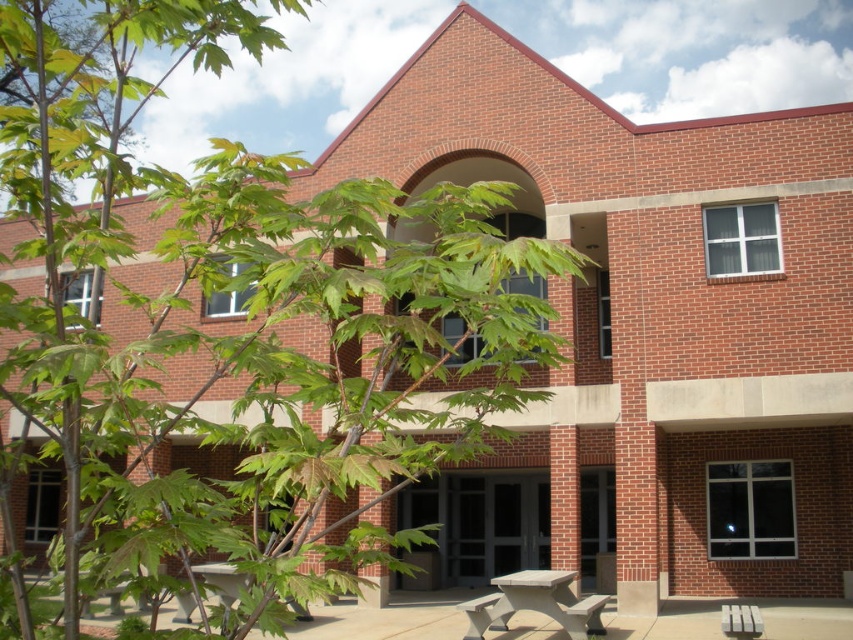
Can you confirm if white plastic park bench at lower right is positioned above smooth gray bench at lower center?

Yes.

Can you confirm if white plastic park bench at lower right is taller than smooth gray bench at lower center?

Incorrect, white plastic park bench at lower right's height is not larger of smooth gray bench at lower center's.

Does point (756, 616) come closer to viewer compared to point (581, 608)?

Yes, point (756, 616) is in front of point (581, 608).

Find the location of `white plastic park bench at lower right`. white plastic park bench at lower right is located at coordinates (741, 621).

Between point (366, 224) and point (479, 637), which one is positioned in front?

Point (366, 224)

Find the location of a particular element. The height and width of the screenshot is (640, 853). green leafy tree at center is located at coordinates (247, 317).

Can you confirm if green leafy tree at center is positioned to the left of white plastic park bench at lower right?

Yes, green leafy tree at center is to the left of white plastic park bench at lower right.

Based on the photo, does green leafy tree at center have a greater width compared to white plastic park bench at lower right?

Yes.

Between point (245, 353) and point (735, 630), which one is positioned in front?

Point (245, 353) is in front.

What are the coordinates of `green leafy tree at center` in the screenshot? It's located at (247, 317).